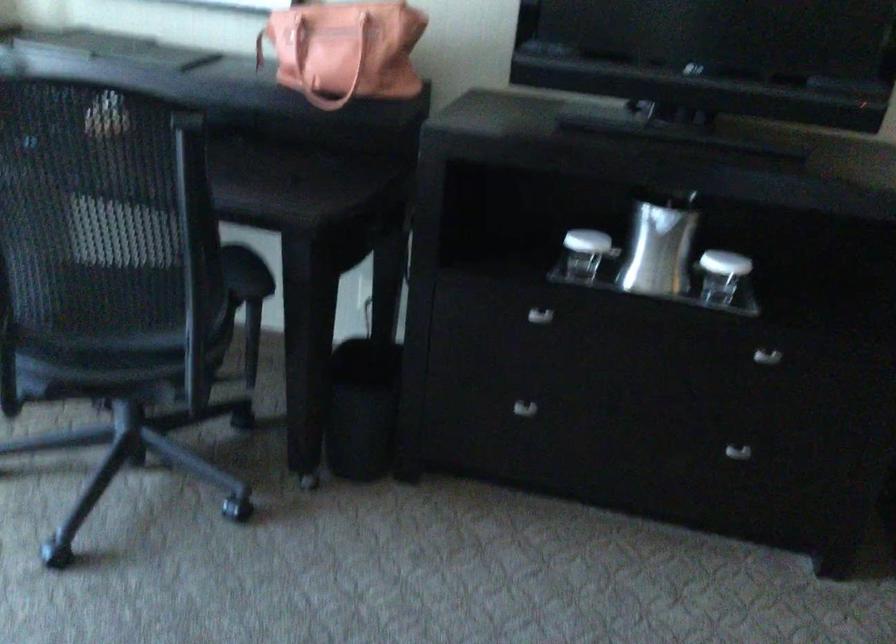
The height and width of the screenshot is (644, 896). In order to click on orange handbag handle in this screenshot , I will do `click(315, 57)`.